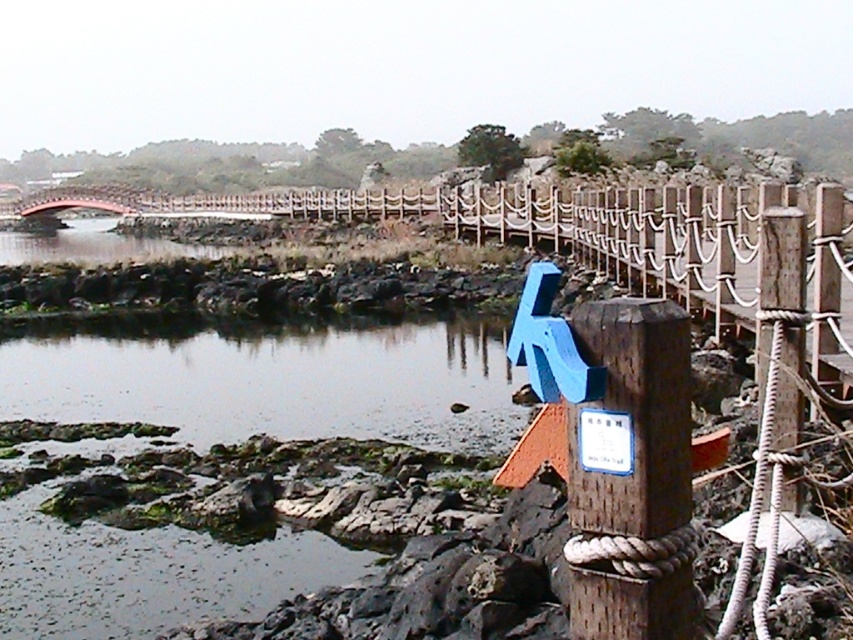
Question: Which of the following is the farthest from the observer?

Choices:
 (A) brown wooden post at center-right
 (B) white paper sign at center

Answer: (B)

Question: Does brown wooden post at center-right appear on the right side of white paper sign at center?

Choices:
 (A) yes
 (B) no

Answer: (A)

Question: Does brown wooden post at center-right have a lesser width compared to white paper sign at center?

Choices:
 (A) yes
 (B) no

Answer: (B)

Question: Which object is closer to the camera taking this photo?

Choices:
 (A) white paper sign at center
 (B) brown wooden post at center-right

Answer: (B)

Question: In this image, where is brown wooden post at center-right located relative to white paper sign at center?

Choices:
 (A) below
 (B) above

Answer: (A)